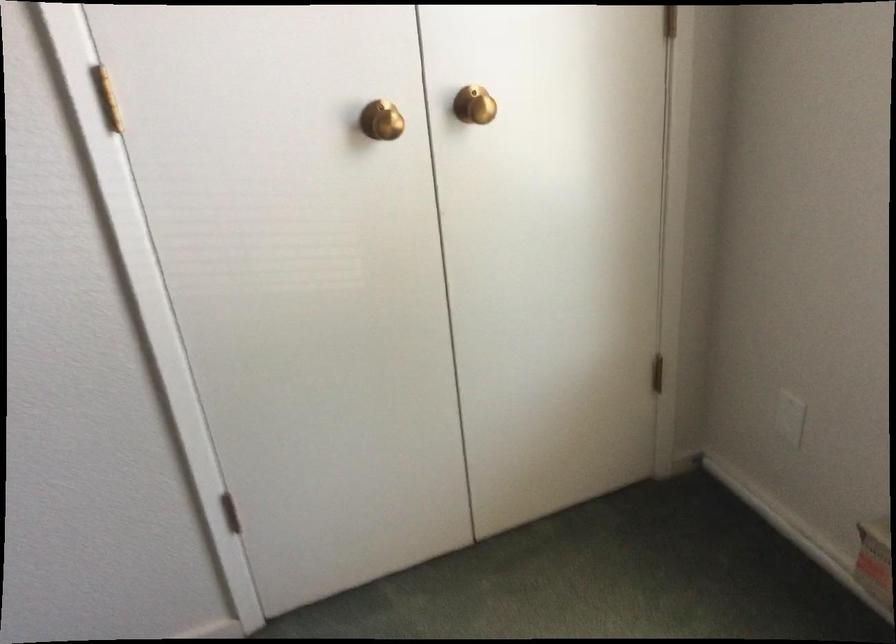
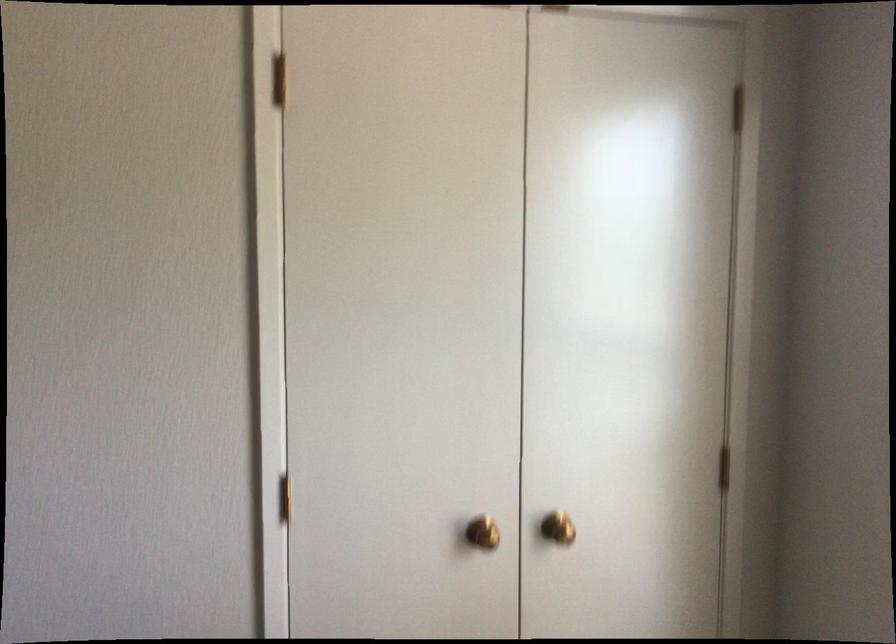
The point at (392, 95) is marked in the first image. Where is the corresponding point in the second image?

(483, 533)